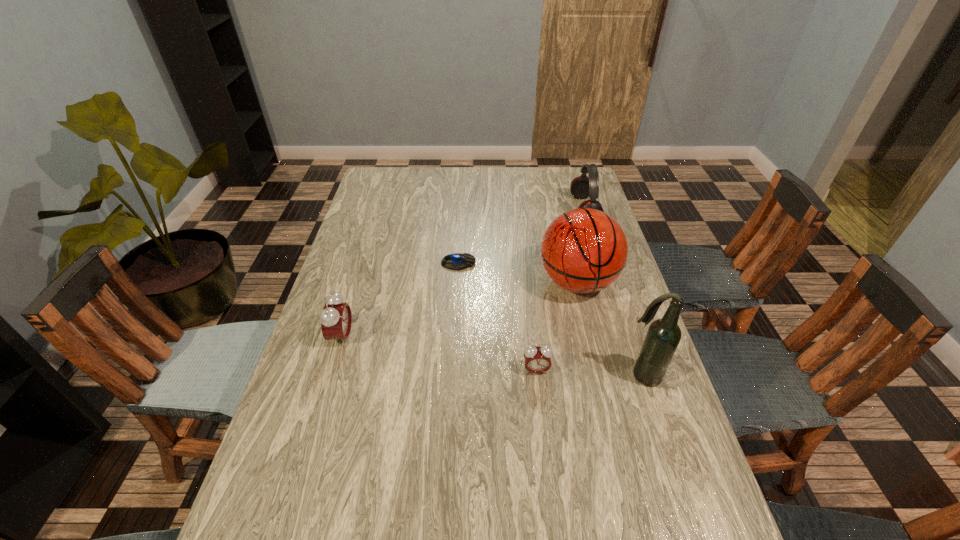
You are a GUI agent. You are given a task and a screenshot of the screen. Output one action in this format:
    pyautogui.click(x=<x>, y=<y>)
    Task: Click on the vacant spot for a new alarm_clock to ensure equal spacing
    
    Given the screenshot: What is the action you would take?
    (436, 353)